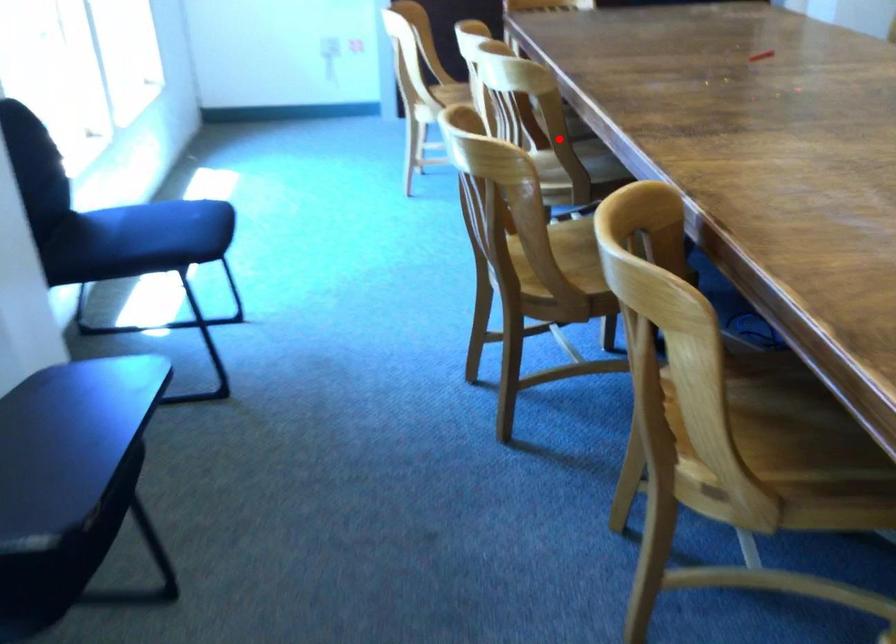
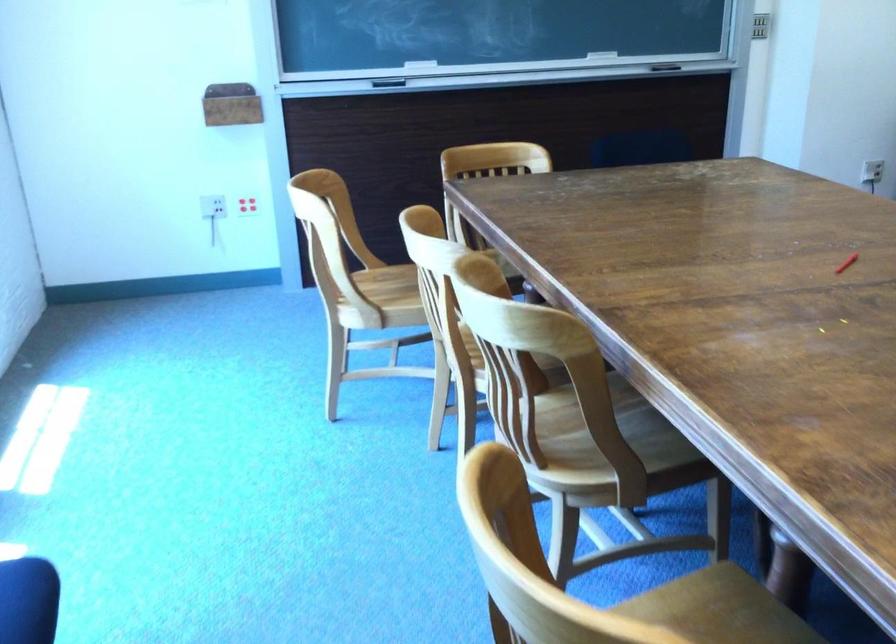
Find the pixel in the second image that matches the highlighted location in the first image.

(606, 422)